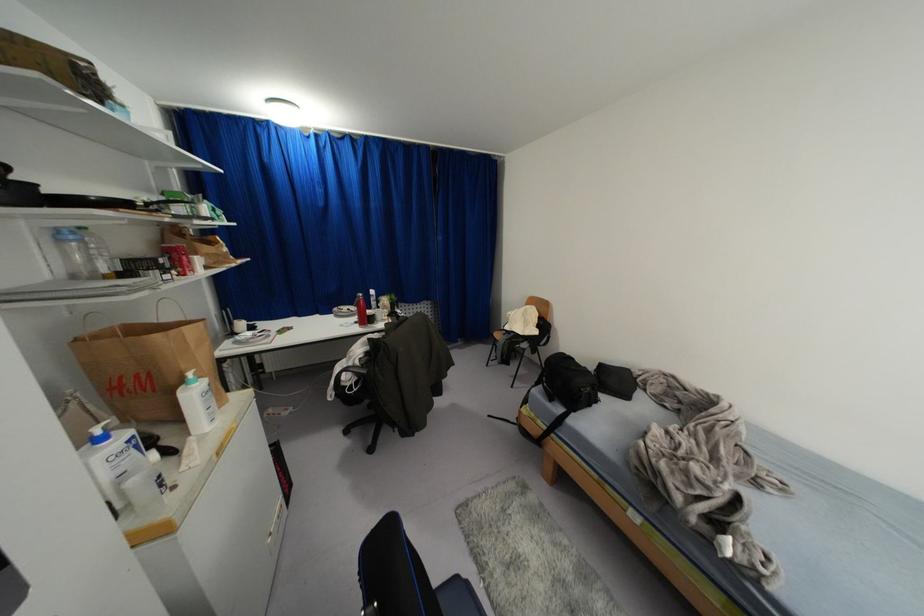
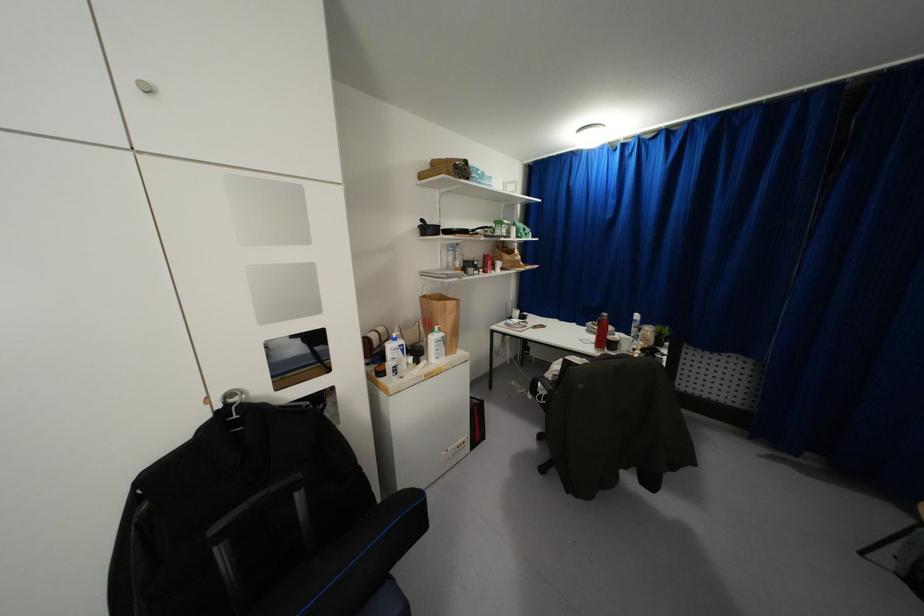
Where in the second image is the point corresponding to (137,446) from the first image?

(402, 350)